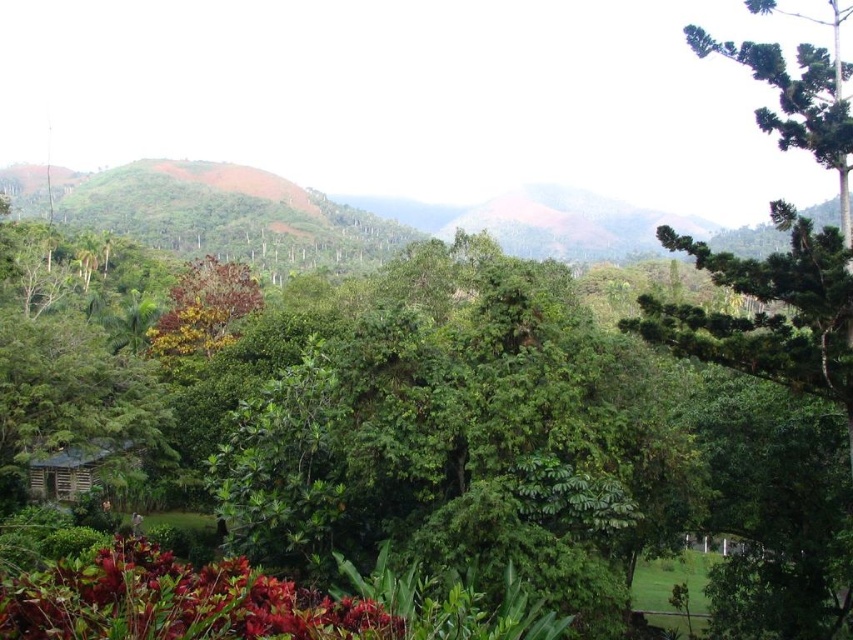
Is point (730, 397) closer to viewer compared to point (357, 632)?

No, it is not.

Does green leafy tree at center have a lesser width compared to shiny red leaves at bottom left?

No.

Locate an element on the screen. green leafy tree at center is located at coordinates (479, 468).